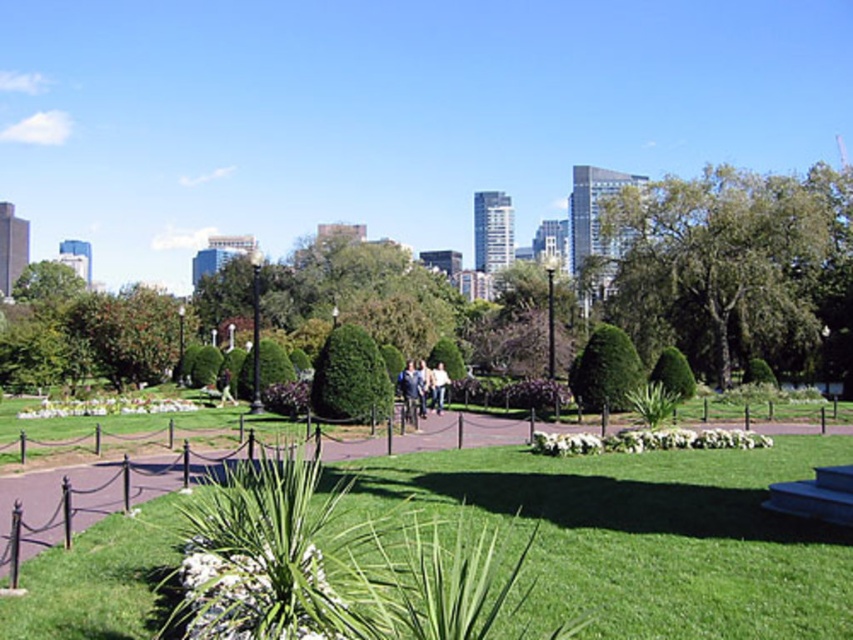
Between green leafy tree at center-right and green textured bush at center, which one is positioned higher?

green leafy tree at center-right

Does green leafy tree at center-right come in front of green textured bush at center?

No, it is behind green textured bush at center.

Which is behind, point (787, 285) or point (374, 380)?

Point (787, 285)

Find the location of `green leafy tree at center-right`. green leafy tree at center-right is located at coordinates (721, 266).

Can you confirm if green grass at center is positioned below white cotton shirt at center?

No.

Measure the distance from green grass at center to white cotton shirt at center.

green grass at center is 55.38 feet from white cotton shirt at center.

Which is behind, point (770, 452) or point (432, 397)?

Point (432, 397)

You are a GUI agent. You are given a task and a screenshot of the screen. Output one action in this format:
    pyautogui.click(x=<x>, y=<y>)
    Task: Click on the green grass at center
    This screenshot has height=640, width=853.
    Given the screenshot: What is the action you would take?
    pyautogui.click(x=648, y=536)

From the picture: Can you confirm if blue denim jeans at center is positioned to the left of white cotton shirt at center?

Yes, blue denim jeans at center is to the left of white cotton shirt at center.

Is blue denim jeans at center below white cotton shirt at center?

Incorrect, blue denim jeans at center is not positioned below white cotton shirt at center.

Which is behind, point (413, 388) or point (440, 392)?

Positioned behind is point (440, 392).

The height and width of the screenshot is (640, 853). What are the coordinates of `blue denim jeans at center` in the screenshot? It's located at (410, 392).